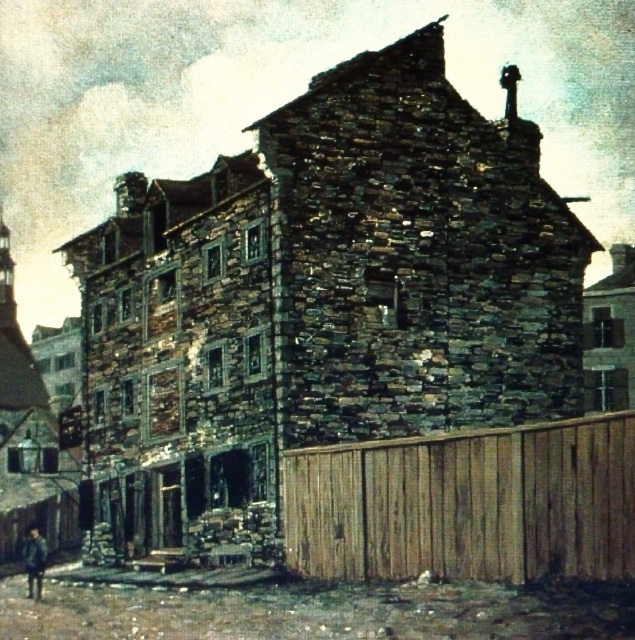
You are standing in front of the historic stone building and notice a point marked at coordinates (465, 502). What does this point represent?

The point at coordinates (465, 502) represents the brown wooden fence at right.

You are standing in front of the historic stone building and want to determine the relative positions of two points marked on the structure. Which point, point (352, 579) or point (27, 540), is closer to you?

Point (352, 579) is closer to the viewer than point (27, 540).